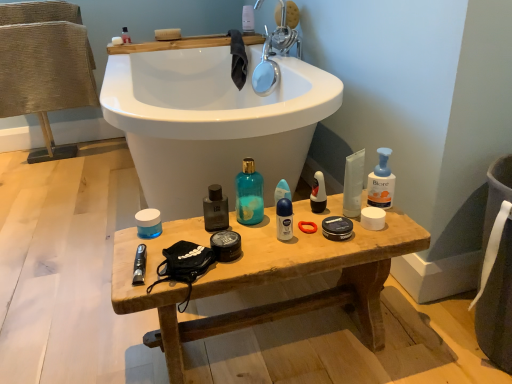
This screenshot has width=512, height=384. What are the coordinates of `free space to the right of blue matte deodorant stick at center, which ranks as the fifth toiletry in front-to-back order` in the screenshot? It's located at (337, 213).